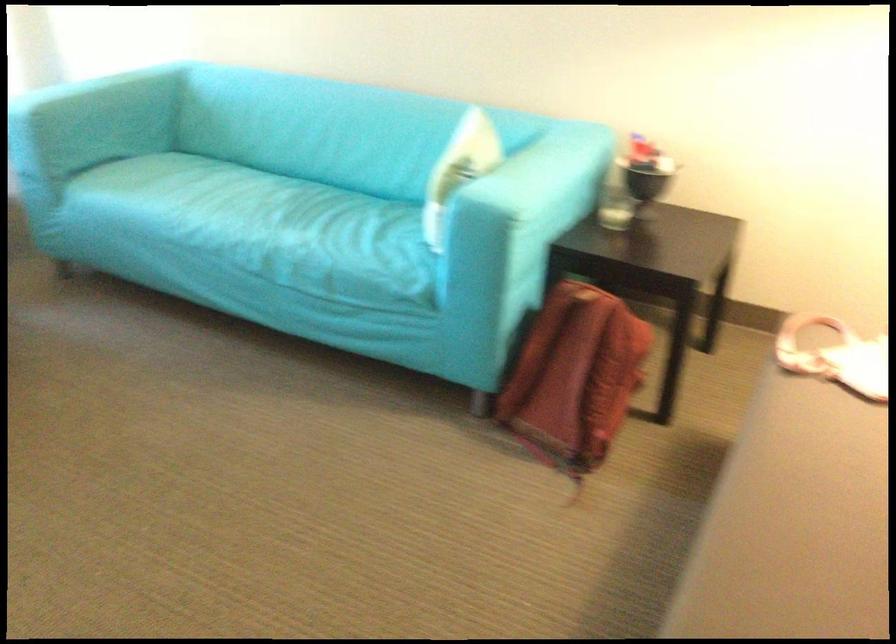
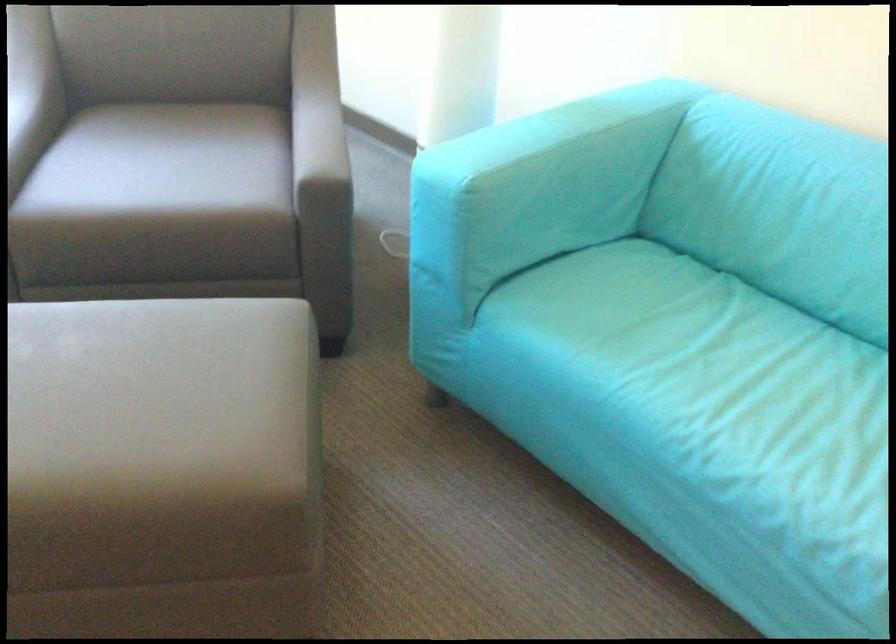
The point at (171,182) is marked in the first image. Where is the corresponding point in the second image?

(699, 353)